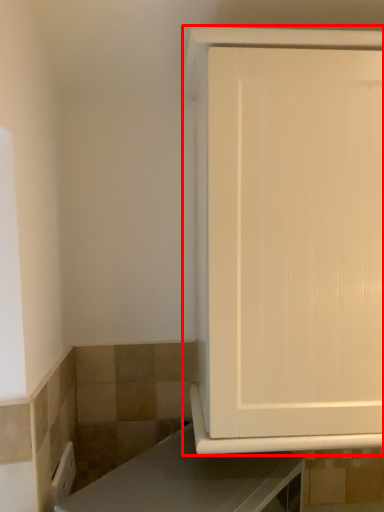
Question: Observing the image, what is the correct spatial positioning of cabinetry (annotated by the red box) in reference to countertop?

Choices:
 (A) right
 (B) left

Answer: (A)